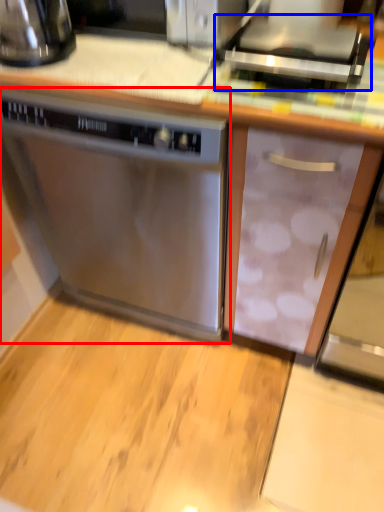
Question: Which object appears farthest to the camera in this image, home appliance (highlighted by a red box) or appliance (highlighted by a blue box)?

Choices:
 (A) home appliance
 (B) appliance

Answer: (A)